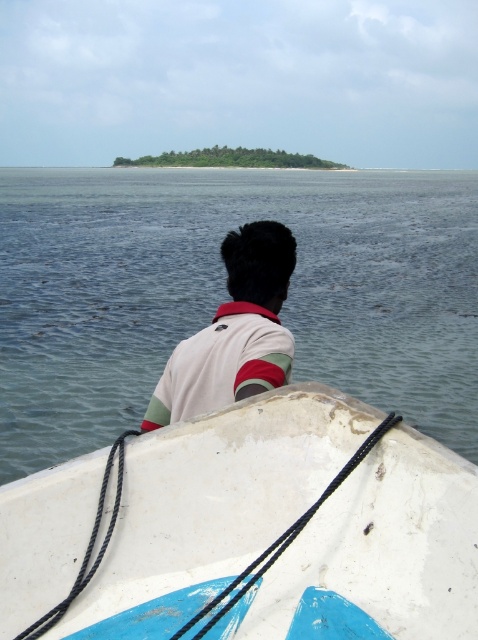
Who is lower down, clear water at center or white cotton shirt at center?

white cotton shirt at center is lower down.

What do you see at coordinates (227, 294) in the screenshot?
I see `clear water at center` at bounding box center [227, 294].

Locate an element on the screen. clear water at center is located at coordinates (227, 294).

Between point (297, 492) and point (147, 422), which one is positioned behind?

Point (147, 422)

How far apart are white matte boat at center and white cotton shirt at center?

The distance of white matte boat at center from white cotton shirt at center is 25.73 inches.

Is point (239, 493) more distant than point (189, 344)?

No.

The width and height of the screenshot is (478, 640). Find the location of `white matte boat at center`. white matte boat at center is located at coordinates (217, 493).

Looking at this image, is clear water at center taller than white matte boat at center?

Yes, clear water at center is taller than white matte boat at center.

Which is more to the left, clear water at center or white matte boat at center?

clear water at center

Who is more distant from viewer, (77,324) or (295,541)?

The point (77,324) is more distant.

Identify the location of clear water at center. (227, 294).